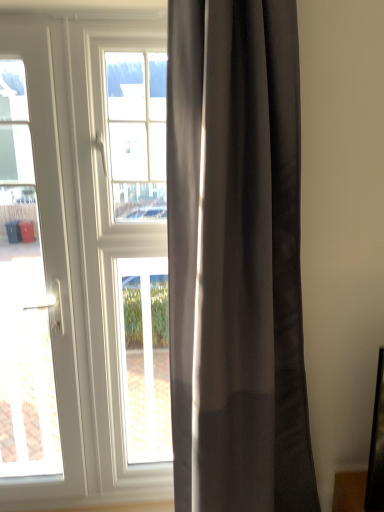
Question: Considering the relative positions of white glass window at center and clear glass window at center in the image provided, is white glass window at center to the left of clear glass window at center from the viewer's perspective?

Choices:
 (A) no
 (B) yes

Answer: (B)

Question: From a real-world perspective, is white glass window at center located higher than clear glass window at center?

Choices:
 (A) no
 (B) yes

Answer: (B)

Question: Would you say clear glass window at center is part of white glass window at center's contents?

Choices:
 (A) yes
 (B) no

Answer: (B)

Question: Can you confirm if white glass window at center is wider than clear glass window at center?

Choices:
 (A) yes
 (B) no

Answer: (A)

Question: Is white glass window at center completely or partially outside of clear glass window at center?

Choices:
 (A) yes
 (B) no

Answer: (A)

Question: From the image's perspective, is clear glass window at center positioned above or below white glossy door at left?

Choices:
 (A) above
 (B) below

Answer: (B)

Question: In terms of width, does clear glass window at center look wider or thinner when compared to white glossy door at left?

Choices:
 (A) wide
 (B) thin

Answer: (B)

Question: Is point [x=152, y=361] closer or farther from the camera than point [x=44, y=170]?

Choices:
 (A) farther
 (B) closer

Answer: (A)

Question: From a real-world perspective, is clear glass window at center positioned above or below white glossy door at left?

Choices:
 (A) above
 (B) below

Answer: (B)

Question: Relative to white glossy door at left, is satin gray curtain at center in front or behind?

Choices:
 (A) front
 (B) behind

Answer: (A)

Question: Is satin gray curtain at center wider or thinner than white glossy door at left?

Choices:
 (A) wide
 (B) thin

Answer: (A)

Question: Considering the positions of point (175, 194) and point (67, 269), is point (175, 194) closer or farther from the camera than point (67, 269)?

Choices:
 (A) farther
 (B) closer

Answer: (B)

Question: From their relative heights in the image, would you say satin gray curtain at center is taller or shorter than white glossy door at left?

Choices:
 (A) short
 (B) tall

Answer: (A)

Question: Is white glass window at center to the left or to the right of clear glass window at center in the image?

Choices:
 (A) right
 (B) left

Answer: (B)

Question: Considering the positions of white glass window at center and clear glass window at center in the image, is white glass window at center wider or thinner than clear glass window at center?

Choices:
 (A) wide
 (B) thin

Answer: (A)